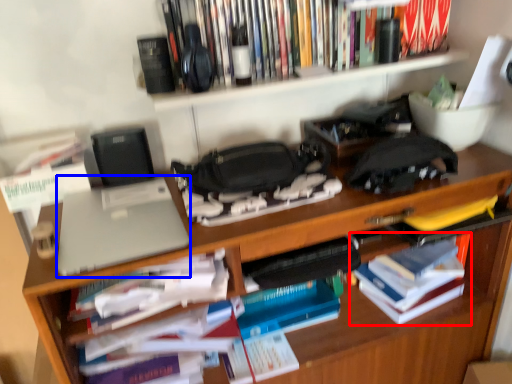
Question: Which object appears closest to the camera in this image, book (highlighted by a red box) or laptop (highlighted by a blue box)?

Choices:
 (A) book
 (B) laptop

Answer: (B)